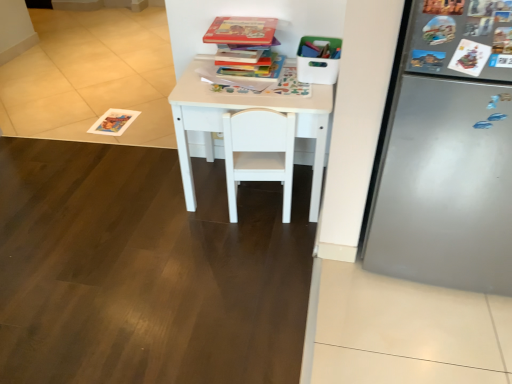
What are the coordinates of `empty space that is ontop of hardcover book at upper center, the second book viewed from the top (from a real-world perspective)` in the screenshot? It's located at (239, 51).